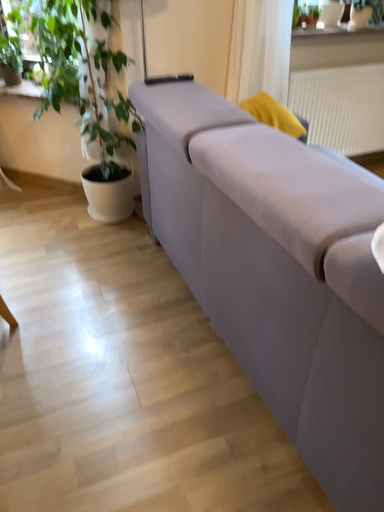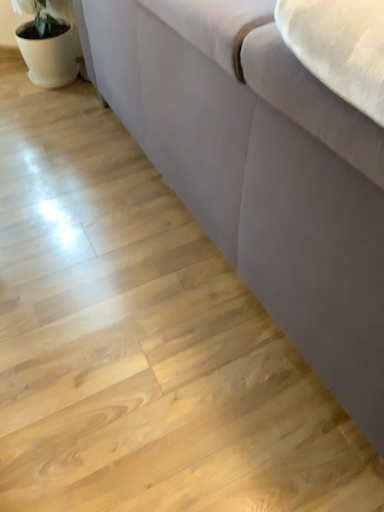
Question: Which way did the camera rotate in the video?

Choices:
 (A) rotated downward
 (B) rotated upward

Answer: (A)